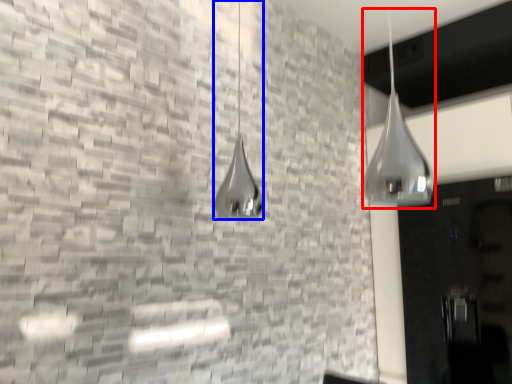
Question: Which object appears farthest to the camera in this image, shower (highlighted by a red box) or shower (highlighted by a blue box)?

Choices:
 (A) shower
 (B) shower

Answer: (B)